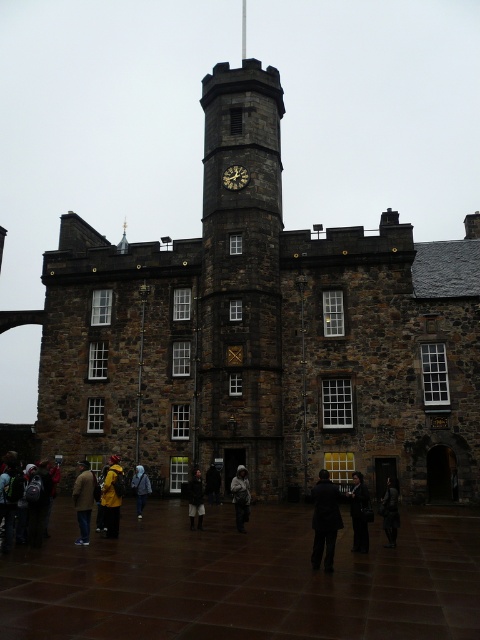
You are standing in front of the historic stone building. You see a dark brown leather jacket at lower left. Where exactly is the dark brown leather jacket located in the image?

The dark brown leather jacket at lower left is located at the 2D coordinate point of [84,500] in the image.